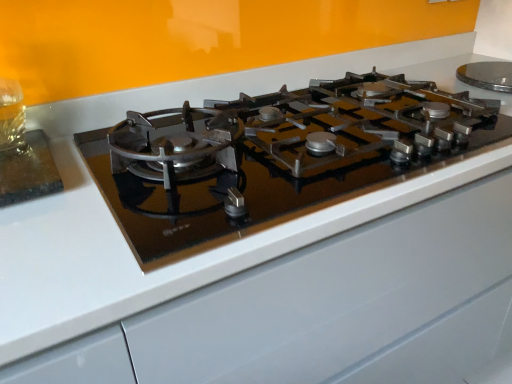
Identify the location of satin black gas stove at center. This screenshot has height=384, width=512. (275, 157).

What do you see at coordinates (275, 157) in the screenshot? The height and width of the screenshot is (384, 512). I see `satin black gas stove at center` at bounding box center [275, 157].

Identify the location of satin black gas stove at center. (275, 157).